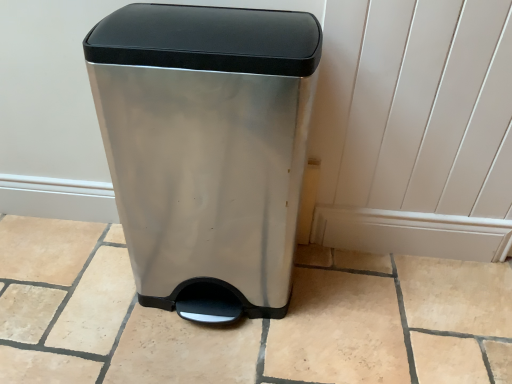
What is the approximate width of satin silver trash can at center?

The width of satin silver trash can at center is 12.88 inches.

The height and width of the screenshot is (384, 512). Find the location of `satin silver trash can at center`. satin silver trash can at center is located at coordinates (207, 149).

Describe the element at coordinates (207, 149) in the screenshot. I see `satin silver trash can at center` at that location.

Find the location of a particular element. satin silver trash can at center is located at coordinates (207, 149).